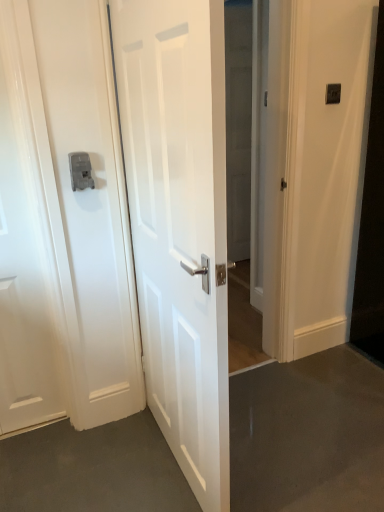
Question: Considering the relative sizes of white glossy door at center, the 2th door when ordered from left to right, and transparent glass door at center in the image provided, is white glossy door at center, the 2th door when ordered from left to right, thinner than transparent glass door at center?

Choices:
 (A) yes
 (B) no

Answer: (B)

Question: Can you confirm if white glossy door at center, the 2th door when ordered from left to right, is bigger than transparent glass door at center?

Choices:
 (A) yes
 (B) no

Answer: (A)

Question: Is white glossy door at center, positioned as the 1th door in right-to-left order, surrounding transparent glass door at center?

Choices:
 (A) no
 (B) yes

Answer: (A)

Question: Can you confirm if white glossy door at center, the 2th door when ordered from left to right, is smaller than transparent glass door at center?

Choices:
 (A) yes
 (B) no

Answer: (B)

Question: Is white glossy door at center, the 2th door when ordered from left to right, not near transparent glass door at center?

Choices:
 (A) yes
 (B) no

Answer: (A)

Question: Considering their positions, is satin silver latch at left located in front of or behind white glossy door at center, positioned as the 1th door in right-to-left order?

Choices:
 (A) front
 (B) behind

Answer: (B)

Question: Is point [x=86, y=157] closer or farther from the camera than point [x=173, y=102]?

Choices:
 (A) closer
 (B) farther

Answer: (B)

Question: From a real-world perspective, is satin silver latch at left above or below white glossy door at center, the 2th door when ordered from left to right?

Choices:
 (A) below
 (B) above

Answer: (B)

Question: In the image, is satin silver latch at left on the left side or the right side of white glossy door at center, positioned as the 1th door in right-to-left order?

Choices:
 (A) right
 (B) left

Answer: (B)

Question: Is white glossy door at left, arranged as the 2th door when viewed from the right, bigger or smaller than satin silver latch at left?

Choices:
 (A) small
 (B) big

Answer: (B)

Question: Considering the positions of white glossy door at left, arranged as the 2th door when viewed from the right, and satin silver latch at left in the image, is white glossy door at left, arranged as the 2th door when viewed from the right, wider or thinner than satin silver latch at left?

Choices:
 (A) thin
 (B) wide

Answer: (A)

Question: Is white glossy door at left, which is the 1th door in left-to-right order, taller or shorter than satin silver latch at left?

Choices:
 (A) tall
 (B) short

Answer: (A)

Question: Choose the correct answer: Is white glossy door at left, which is the 1th door in left-to-right order, inside satin silver latch at left or outside it?

Choices:
 (A) inside
 (B) outside

Answer: (B)

Question: From the image's perspective, relative to transparent glass door at center, is black plastic light switch at upper right above or below?

Choices:
 (A) below
 (B) above

Answer: (A)

Question: Based on their sizes in the image, would you say black plastic light switch at upper right is bigger or smaller than transparent glass door at center?

Choices:
 (A) small
 (B) big

Answer: (A)